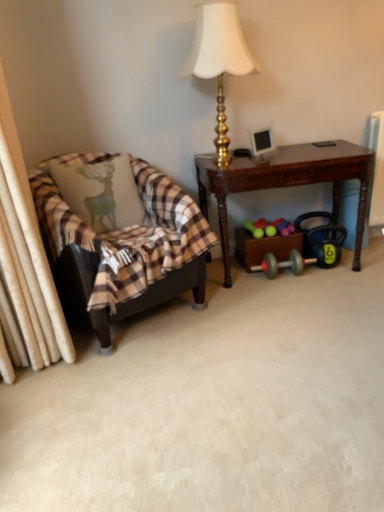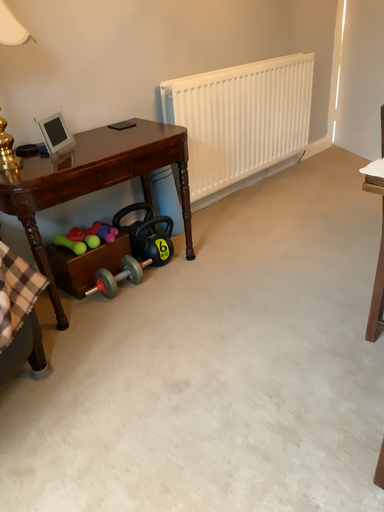
Question: Which way did the camera rotate in the video?

Choices:
 (A) rotated left
 (B) rotated right

Answer: (B)